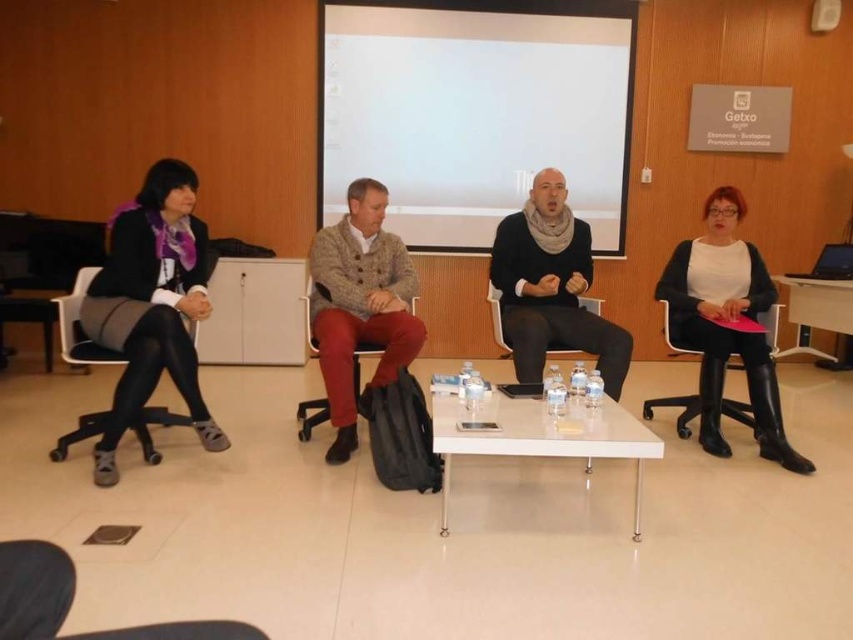
You are a photographer setting up for a group photo in the conference room. You need to place a tripod between the black leather boots at right and the white glossy table at right. Based on their positions, where should you place the tripod?

The black leather boots at right is positioned on the left side of white glossy table at right, so you should place the tripod to the left of the white glossy table at right, between the black leather boots at right and the table itself.

You are a delivery person who needs to place a 2.5 meter long package between the knit sweater at center and the white glossy table at right. Can you fit the package between them?

The distance between the knit sweater at center and the white glossy table at right is 2.34 meters, which is shorter than the 2.5 meter package. Therefore, the package cannot fit between them.